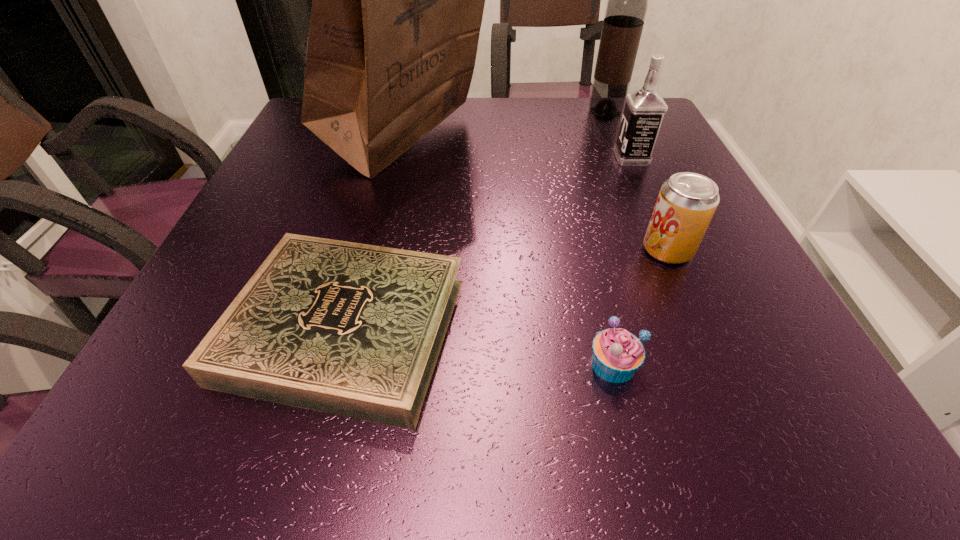
Image resolution: width=960 pixels, height=540 pixels. I want to click on wine bottle at the right edge, so point(627,4).

Locate an element on the screen. vodka that is positioned at the right edge is located at coordinates (644, 110).

The width and height of the screenshot is (960, 540). What are the coordinates of `pop (soda) situated at the right edge` in the screenshot? It's located at (687, 201).

The height and width of the screenshot is (540, 960). Find the location of `object present at the far left corner`. object present at the far left corner is located at coordinates (397, 0).

Locate an element on the screen. The image size is (960, 540). object that is at the near left corner is located at coordinates (351, 329).

Find the location of a particular element. The image size is (960, 540). object at the far right corner is located at coordinates (627, 4).

Identify the location of free space at the far edge of the desktop. (488, 134).

At what (x,y) coordinates should I click in order to perform the action: click on vacant space at the near edge of the desktop. Please return your answer as a coordinate pair (x, y). Looking at the image, I should click on (538, 436).

The height and width of the screenshot is (540, 960). Identify the location of free space at the left edge of the desktop. (239, 268).

You are a GUI agent. You are given a task and a screenshot of the screen. Output one action in this format:
    pyautogui.click(x=<x>, y=<y>)
    Task: Click on the blank space at the right edge of the desktop
    
    Given the screenshot: What is the action you would take?
    pyautogui.click(x=689, y=272)